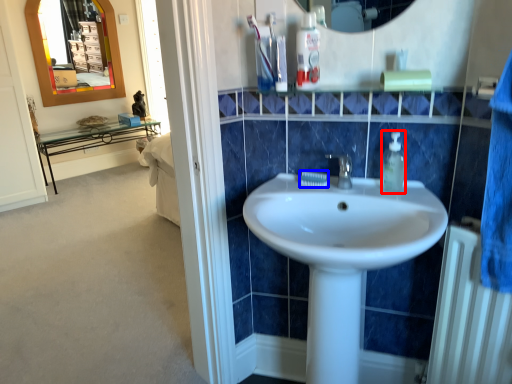
Question: Which point is closer to the camera, soap dispenser (highlighted by a red box) or toothpaste (highlighted by a blue box)?

Choices:
 (A) soap dispenser
 (B) toothpaste

Answer: (A)